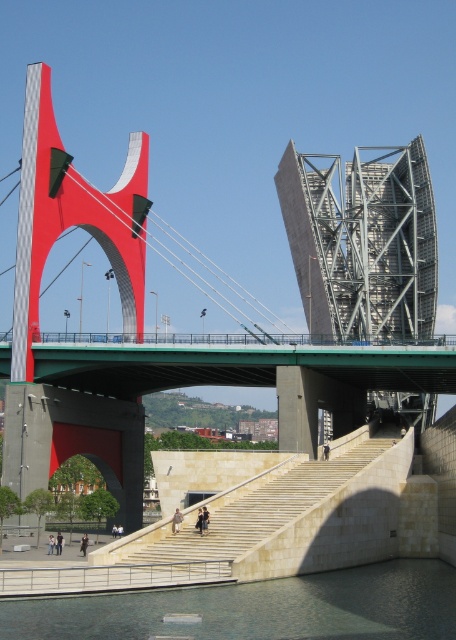
You are a delivery drone carrying a package that requires a landing zone at least 6 meters wide. You are hovering above the dark green water at lower center and need to land on the light beige stone stairs at center. Can you safely land there?

The distance between the dark green water at lower center and the light beige stone stone stairs at center is 6.39 meters, which is more than the required 6 meters. Therefore, the drone can safely land on the light beige stone stairs at center from the dark green water at lower center.

In the scene shown: You are standing on the bridge and looking down. You see the dark green water at lower center and the light beige stone stairs at center. Which one is closer to you?

The dark green water at lower center is closer to the viewer than the light beige stone stairs at center.

You are a photographer planning to capture the entire scene in one shot. Given that the dark green water at lower center and the light beige stone stairs at center are both in your frame, which of these two elements takes up more area in the photo?

The light beige stone stairs at center occupies more space than the dark green water at lower center in the photo.